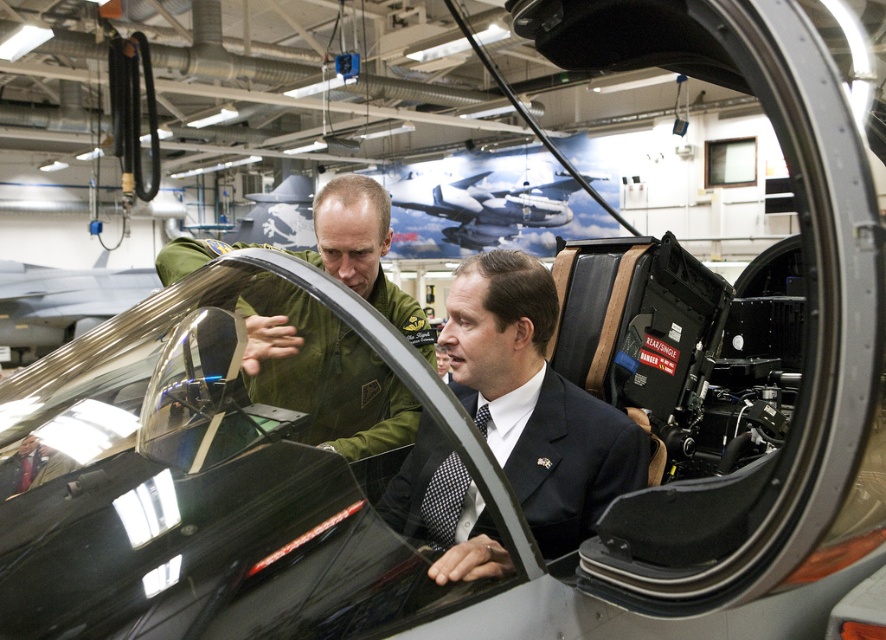
Question: Which point is farther to the camera?

Choices:
 (A) (496, 429)
 (B) (519, 196)
 (C) (369, 380)

Answer: (B)

Question: Is dark green uniform at center to the right of metallic silver aircraft at center from the viewer's perspective?

Choices:
 (A) yes
 (B) no

Answer: (B)

Question: Among these points, which one is nearest to the camera?

Choices:
 (A) 321,317
 (B) 416,438

Answer: (B)

Question: Estimate the real-world distances between objects in this image. Which object is farther from the dark green uniform at center?

Choices:
 (A) green uniform at center
 (B) metallic silver aircraft at center

Answer: (B)

Question: In this image, where is dark green uniform at center located relative to green uniform at center?

Choices:
 (A) left
 (B) right

Answer: (B)

Question: Considering the relative positions of green uniform at center and metallic silver aircraft at center in the image provided, where is green uniform at center located with respect to metallic silver aircraft at center?

Choices:
 (A) left
 (B) right

Answer: (A)